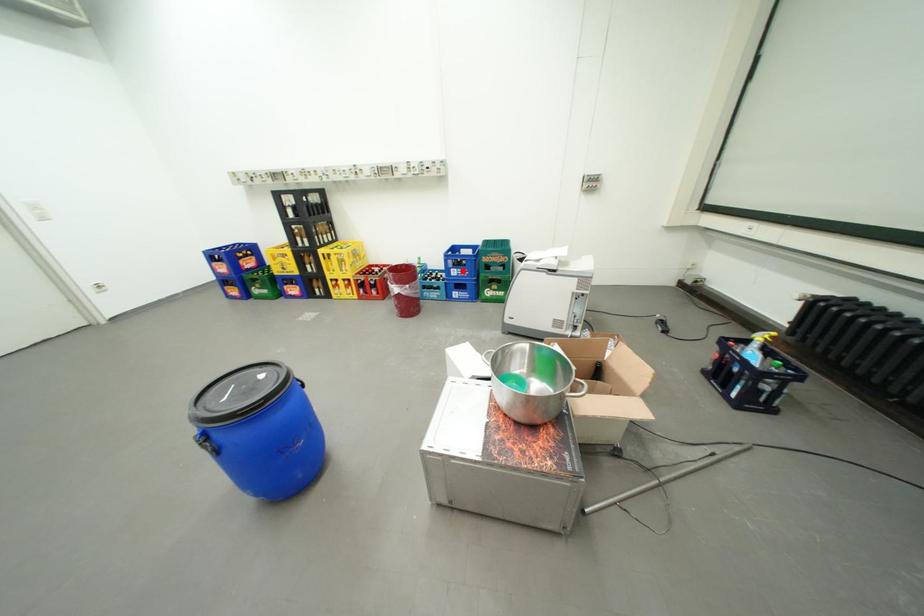
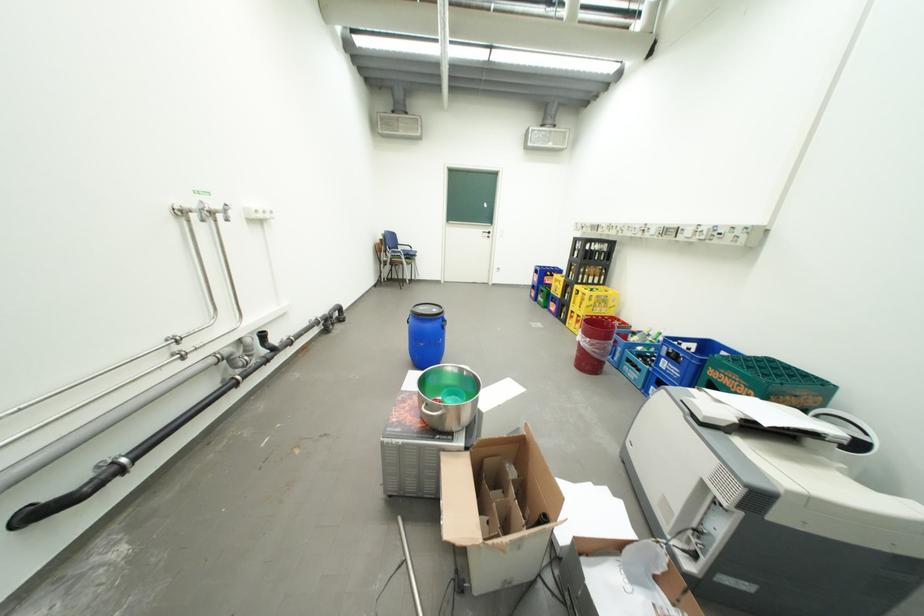
Question: I am providing you with two images of the same scene from different viewpoints. Image1 has a red point marked. In image2, the corresponding 3D location appears at what relative position? Reply with the corresponding letter.

Choices:
 (A) Closer
 (B) Farther

Answer: (A)